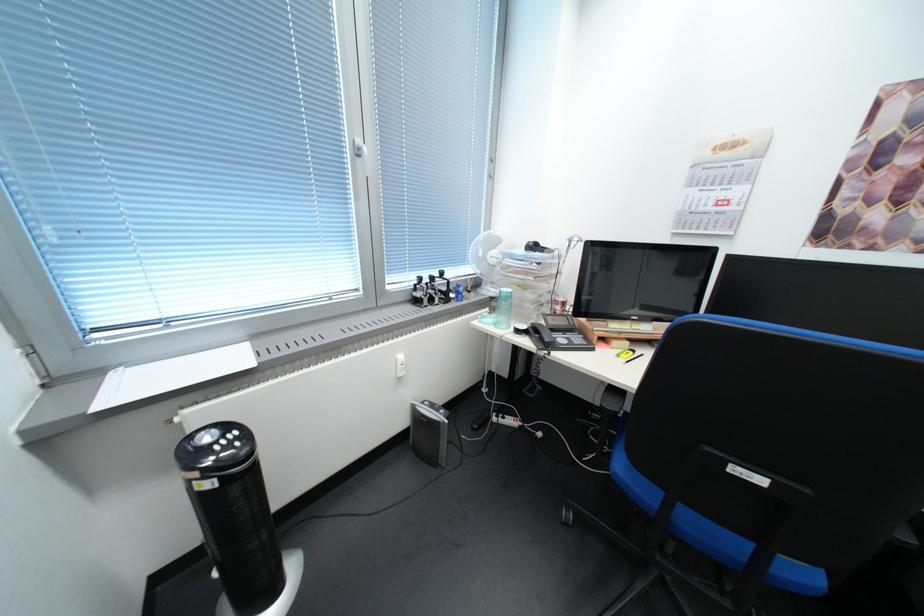
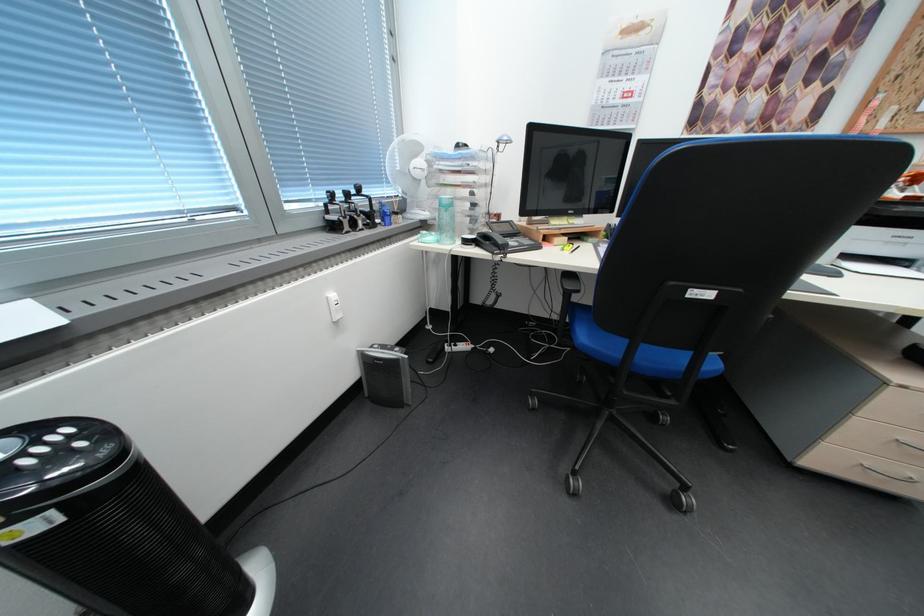
Question: The camera is either moving clockwise (left) or counter-clockwise (right) around the object. The first image is from the beginning of the video and the second image is from the end. Is the camera moving left or right when shooting the video?

Choices:
 (A) Left
 (B) Right

Answer: (A)